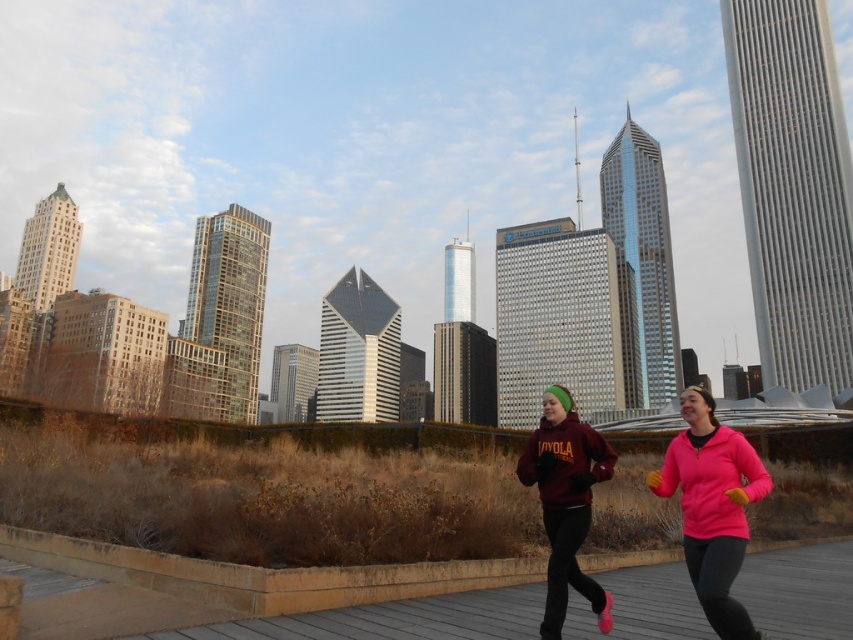
Question: Among these objects, which one is farthest from the camera?

Choices:
 (A) wooden deck at center
 (B) maroon fleece jacket at center
 (C) pink fleece at center

Answer: (B)

Question: Which point is closer to the camera taking this photo?

Choices:
 (A) (592, 451)
 (B) (769, 492)

Answer: (B)

Question: From the image, what is the correct spatial relationship of pink fleece at center in relation to maroon fleece jacket at center?

Choices:
 (A) left
 (B) right

Answer: (B)

Question: Which point is farther from the camera taking this photo?

Choices:
 (A) (741, 582)
 (B) (689, 492)

Answer: (A)

Question: Is wooden deck at center wider than pink fleece at center?

Choices:
 (A) yes
 (B) no

Answer: (A)

Question: Can you confirm if wooden deck at center is positioned below pink fleece at center?

Choices:
 (A) no
 (B) yes

Answer: (B)